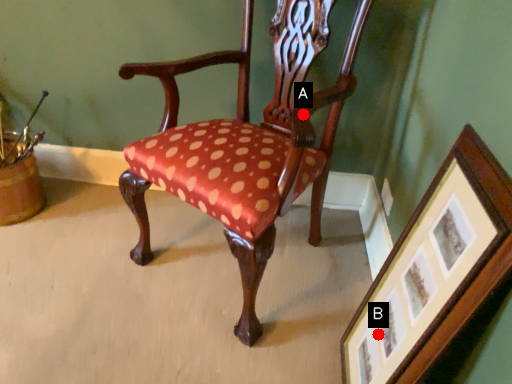
Question: Two points are circled on the image, labeled by A and B beside each circle. Which point is farther to the camera?

Choices:
 (A) A is further
 (B) B is further

Answer: (A)